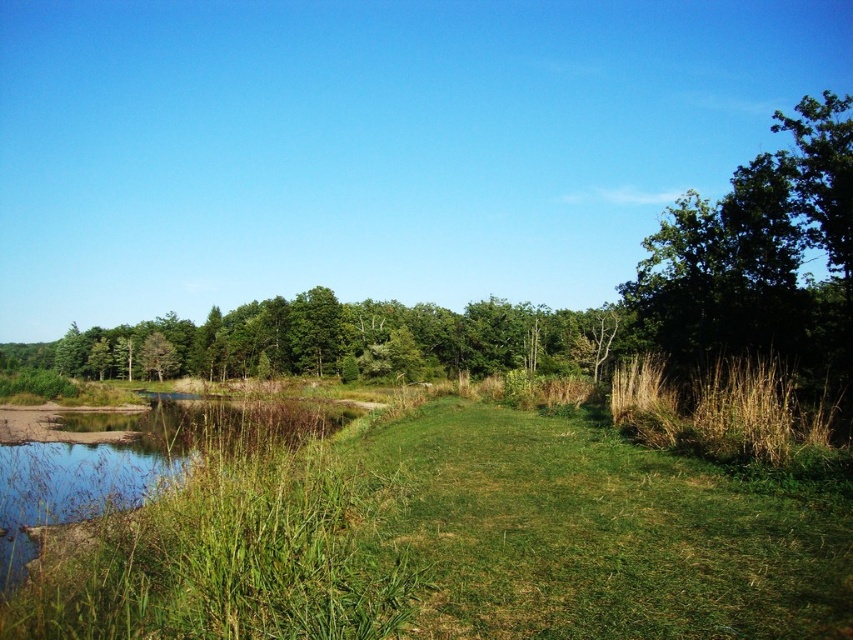
In the scene shown: Does green leafy tree at upper right lie in front of brown grassy reed at right?

No.

Looking at this image, is green leafy tree at upper right smaller than brown grassy reed at right?

Incorrect, green leafy tree at upper right is not smaller in size than brown grassy reed at right.

Is point (825, 365) behind point (665, 435)?

Yes, it is behind point (665, 435).

Identify the location of green leafy tree at upper right. (759, 259).